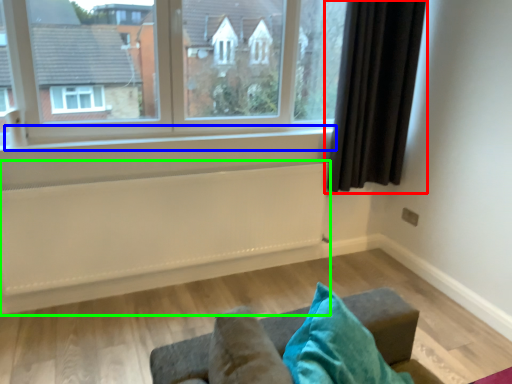
Question: Considering the real-world distances, which object is closest to curtain (highlighted by a red box)? window sill (highlighted by a blue box) or radiator (highlighted by a green box).

Choices:
 (A) window sill
 (B) radiator

Answer: (A)